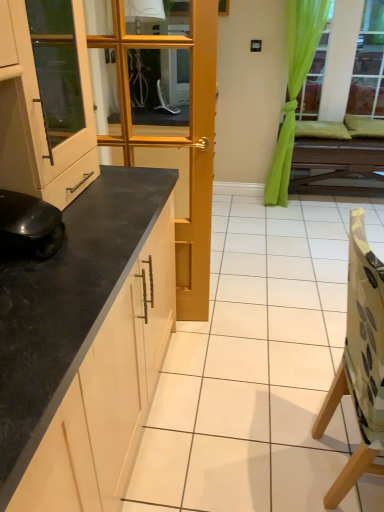
Question: From a real-world perspective, is black granite countertop at left positioned over wooden table at center based on gravity?

Choices:
 (A) no
 (B) yes

Answer: (B)

Question: Is wooden table at center a part of black granite countertop at left?

Choices:
 (A) no
 (B) yes

Answer: (A)

Question: From the image's perspective, would you say black granite countertop at left is shown under wooden table at center?

Choices:
 (A) yes
 (B) no

Answer: (A)

Question: Could you tell me if black granite countertop at left is facing wooden table at center?

Choices:
 (A) no
 (B) yes

Answer: (A)

Question: Is black granite countertop at left far away from wooden table at center?

Choices:
 (A) no
 (B) yes

Answer: (B)

Question: Is black granite countertop at left thinner than wooden table at center?

Choices:
 (A) yes
 (B) no

Answer: (B)

Question: Is wooden table at center positioned beyond the bounds of green fabric curtain at upper right?

Choices:
 (A) no
 (B) yes

Answer: (B)

Question: Does wooden table at center have a lesser width compared to green fabric curtain at upper right?

Choices:
 (A) no
 (B) yes

Answer: (A)

Question: From the image's perspective, is wooden table at center above green fabric curtain at upper right?

Choices:
 (A) no
 (B) yes

Answer: (A)

Question: Considering the relative sizes of wooden table at center and green fabric curtain at upper right in the image provided, is wooden table at center smaller than green fabric curtain at upper right?

Choices:
 (A) no
 (B) yes

Answer: (A)

Question: Is wooden table at center further to the viewer compared to green fabric curtain at upper right?

Choices:
 (A) yes
 (B) no

Answer: (A)

Question: Is green fabric curtain at upper right at the back of wooden table at center?

Choices:
 (A) yes
 (B) no

Answer: (B)

Question: Is camouflage fabric chair at right wider than black granite countertop at left?

Choices:
 (A) no
 (B) yes

Answer: (A)